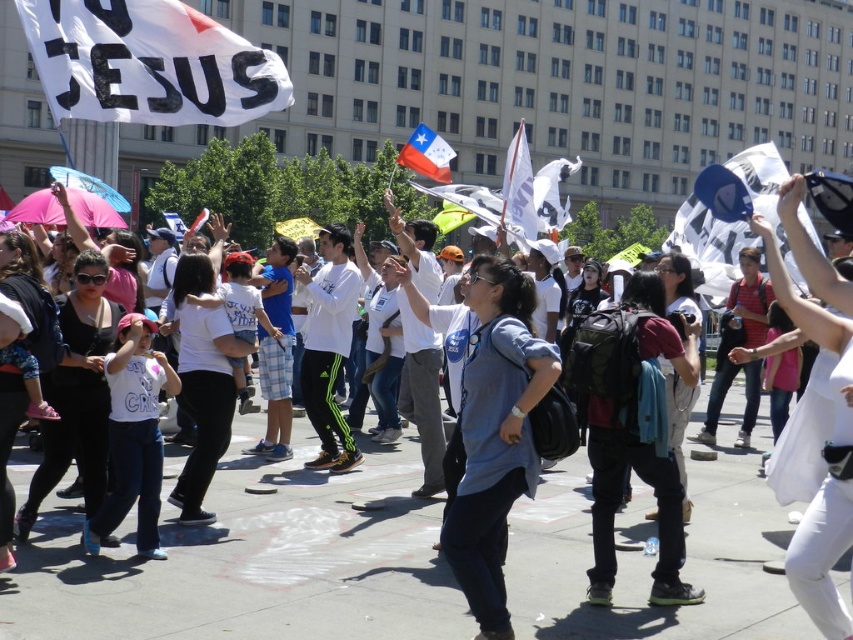
You are standing in the crowd at the protest and want to take a photo of both the point at coordinates (764,177) and the point at coordinates (440,216). Given their positions, which point will appear larger in your photo?

The point at coordinates (764,177) will appear larger in the photo because it is closer to the camera than the point at coordinates (440,216).

Based on the scene description, which object is wider, the white fabric flag at upper left or the polished fabric chilean flag at upper center?

The white fabric flag at upper left might be wider than polished fabric chilean flag at upper center according to the description.